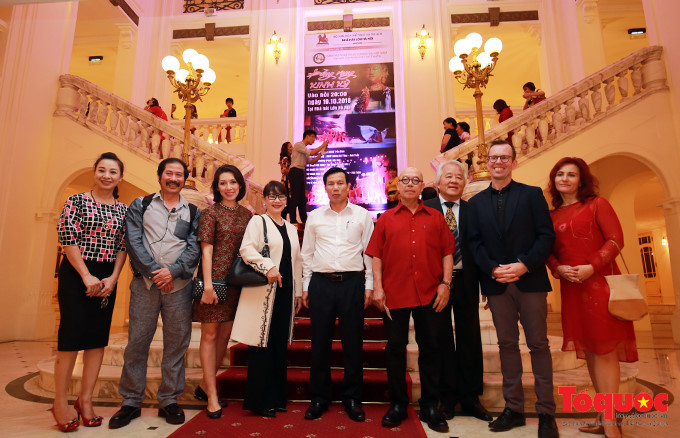
This screenshot has height=438, width=680. Identify the location of staircase on left. (103, 119).